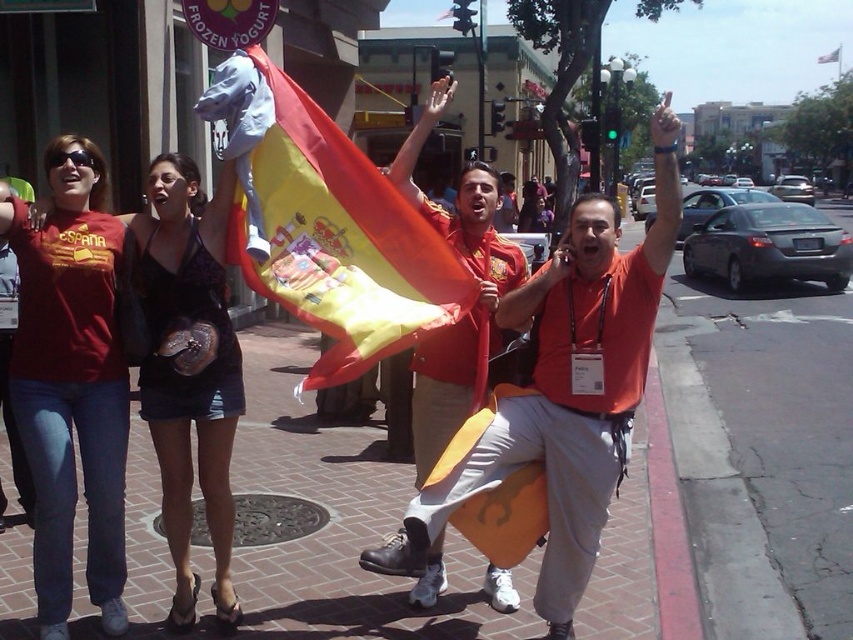
Question: Which is farther from the red fabric flag at center?

Choices:
 (A) red/yellow fabric flag at center
 (B) orange fabric flag at center

Answer: (B)

Question: Which point is closer to the camera?

Choices:
 (A) red/yellow fabric flag at center
 (B) brick pavement at center
 (C) red fabric flag at center
 (D) orange fabric flag at center

Answer: (D)

Question: Is red/yellow fabric flag at center thinner than red fabric flag at center?

Choices:
 (A) yes
 (B) no

Answer: (B)

Question: Is brick pavement at center bigger than orange fabric flag at center?

Choices:
 (A) no
 (B) yes

Answer: (A)

Question: Does red/yellow fabric flag at center have a smaller size compared to red fabric flag at center?

Choices:
 (A) yes
 (B) no

Answer: (B)

Question: Which object appears closest to the camera in this image?

Choices:
 (A) brick pavement at center
 (B) orange fabric flag at center

Answer: (B)